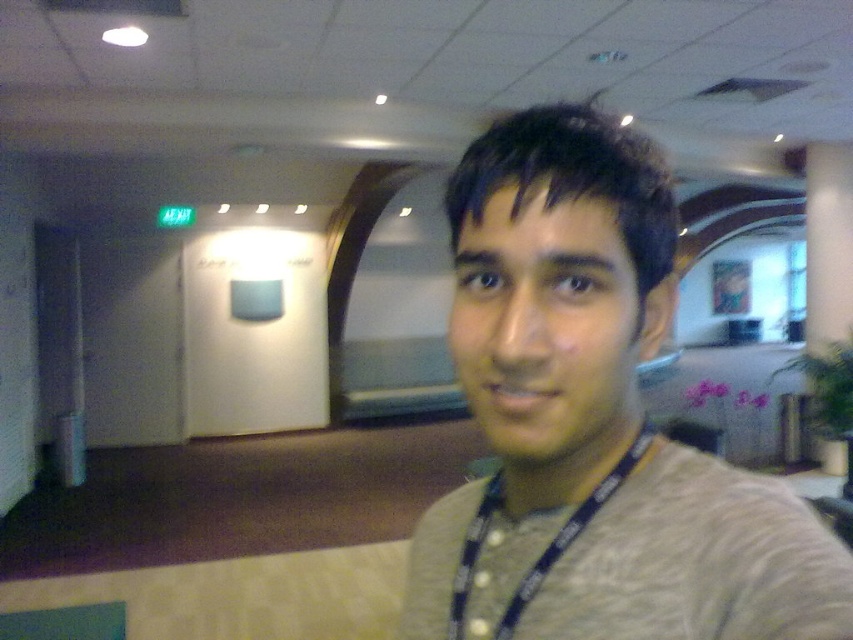
You are an office security guard checking the attire of an employee. You notice the gray cotton shirt at center and the blue fabric lanyard at center. Which item is positioned higher on the employee?

The gray cotton shirt at center is located above the blue fabric lanyard at center, so the gray cotton shirt at center is positioned higher on the employee.

You are an office security guard checking the attire of an employee. The employee is wearing a gray cotton shirt at center and a blue fabric lanyard at center. According to company policy, the lanyard must be larger than the shirt. Does this employee comply with the policy?

The gray cotton shirt at center is bigger than the blue fabric lanyard at center, so the employee does not comply with the company policy since the lanyard must be larger than the shirt.